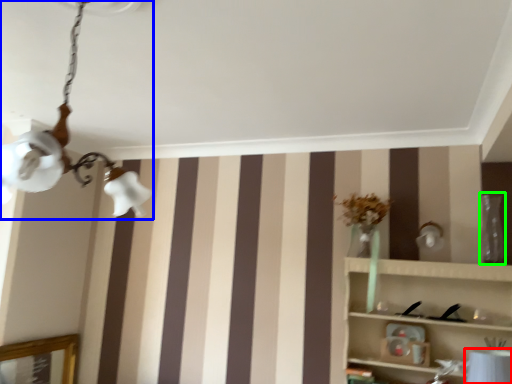
Question: Estimate the real-world distances between objects in this image. Which object is closer to table lamp (highlighted by a red box), lamp (highlighted by a blue box) or glass vase (highlighted by a green box)?

Choices:
 (A) lamp
 (B) glass vase

Answer: (B)